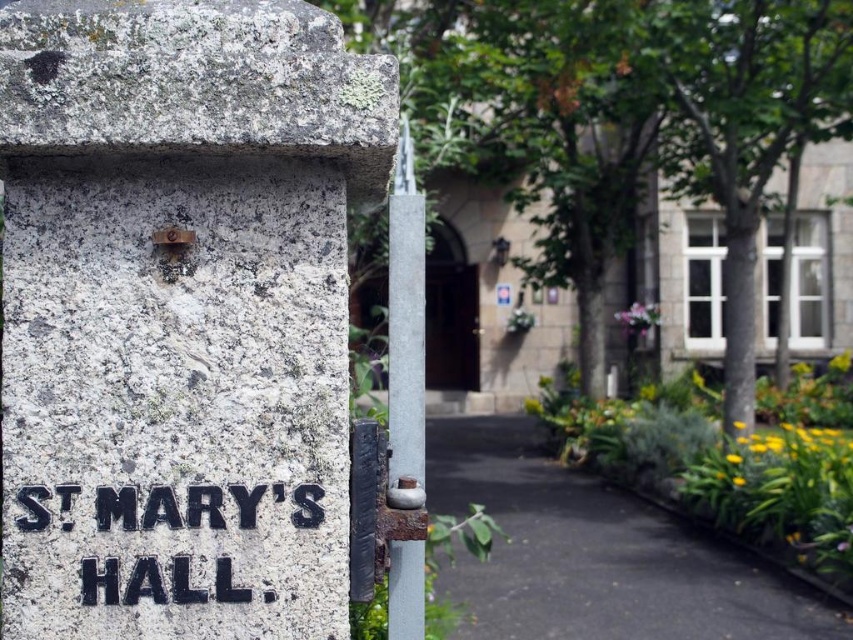
You are standing at the entrance of ST MARYS HALL and need to locate the granite sign at center. According to the coordinates provided, where should you look to find it?

The granite sign at center is located at point (180, 312).

You are standing in front of the stone structure with the inscription. You need to determine which object, the granite sign at center or the black asphalt at center, is taller. Based on the scene description, which one is taller?

The granite sign at center is taller than the black asphalt at center according to the description.